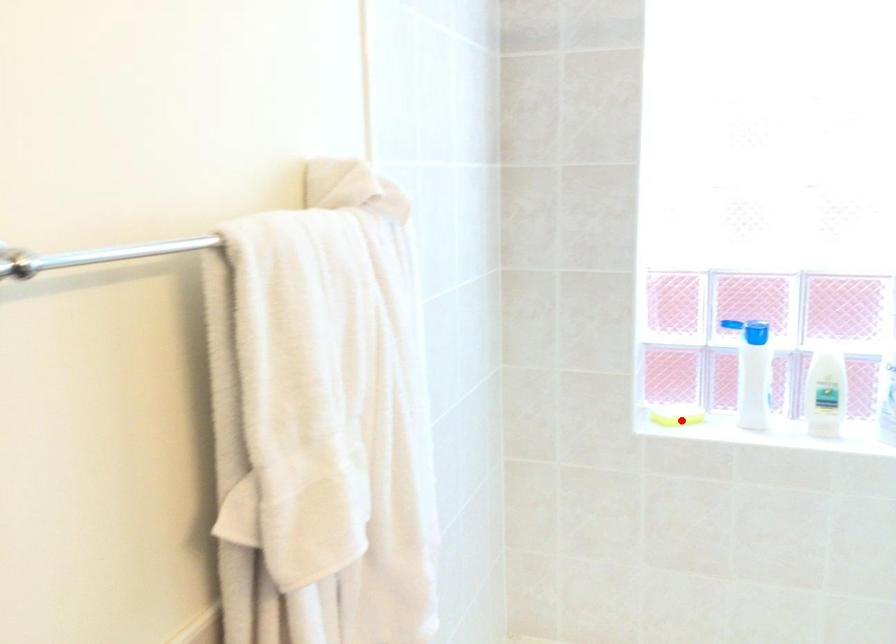
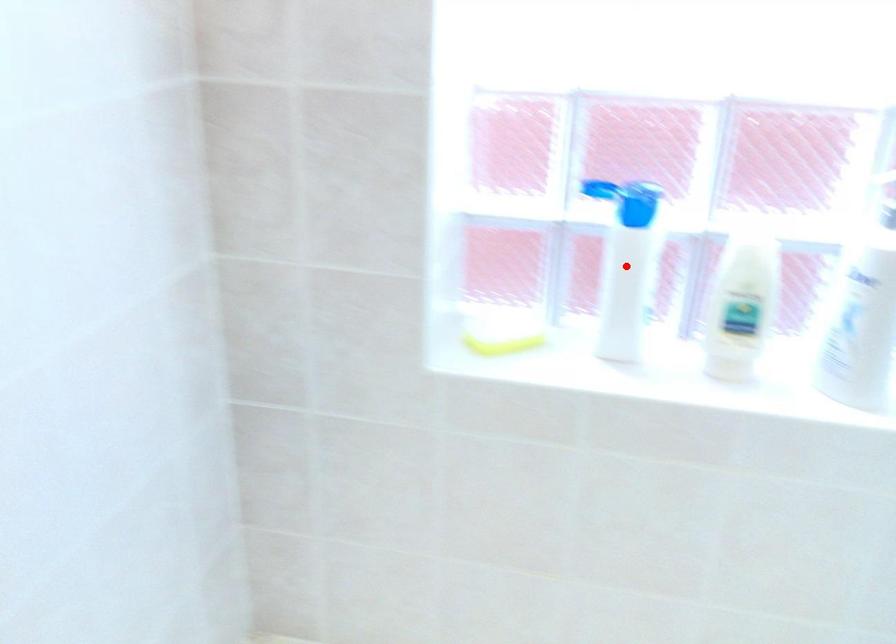
I am providing you with two images of the same scene from different viewpoints. A red point is marked on the first image and another point is marked on the second image. Are the points marked in image1 and image2 representing the same 3D position?

No